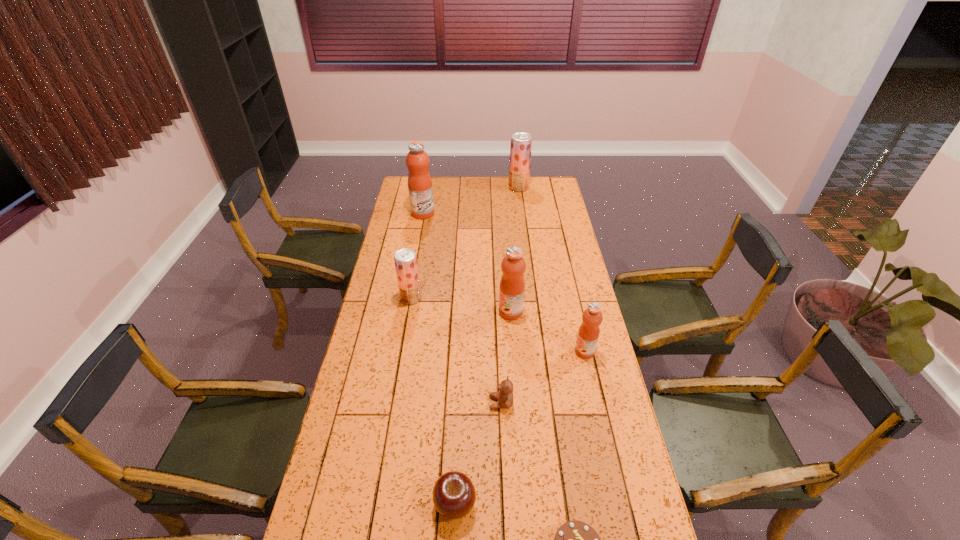
Identify the location of the tallest fruit juice. The height and width of the screenshot is (540, 960). (420, 189).

In order to click on the tallest object in this screenshot , I will do `click(420, 189)`.

Find the location of `the farthest fruit juice`. the farthest fruit juice is located at coordinates (521, 143).

You are a GUI agent. You are given a task and a screenshot of the screen. Output one action in this format:
    pyautogui.click(x=<x>, y=<y>)
    Task: Click on the farthest object
    Image resolution: width=960 pixels, height=540 pixels.
    Given the screenshot: What is the action you would take?
    pyautogui.click(x=521, y=143)

In order to click on the second biggest orange fruit juice in this screenshot , I will do `click(512, 285)`.

You are a GUI agent. You are given a task and a screenshot of the screen. Output one action in this format:
    pyautogui.click(x=<x>, y=<y>)
    Task: Click on the second orange fruit juice from left to right
    Image resolution: width=960 pixels, height=540 pixels.
    Given the screenshot: What is the action you would take?
    tap(512, 285)

Image resolution: width=960 pixels, height=540 pixels. Identify the location of the left strawberry fruit juice. [x=405, y=260].

This screenshot has height=540, width=960. I want to click on the nearer strawberry fruit juice, so click(x=405, y=260).

Locate an element on the screen. the rightmost object is located at coordinates (588, 333).

This screenshot has height=540, width=960. I want to click on the rightmost fruit juice, so click(x=588, y=333).